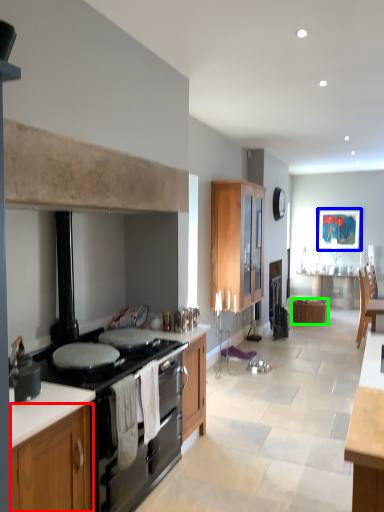
Question: Which object is the farthest from cabinetry (highlighted by a red box)? Choose among these: picture frame (highlighted by a blue box) or cabinetry (highlighted by a green box).

Choices:
 (A) picture frame
 (B) cabinetry

Answer: (A)